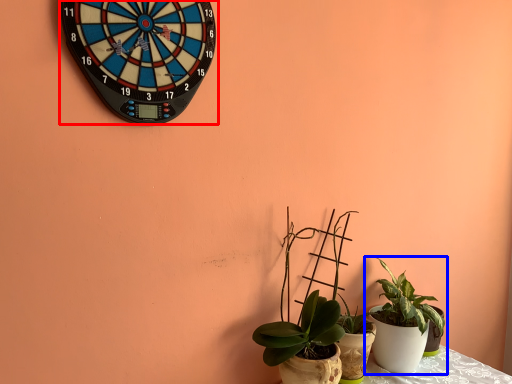
Question: Which object is further to the camera taking this photo, wall clock (highlighted by a red box) or houseplant (highlighted by a blue box)?

Choices:
 (A) wall clock
 (B) houseplant

Answer: (B)